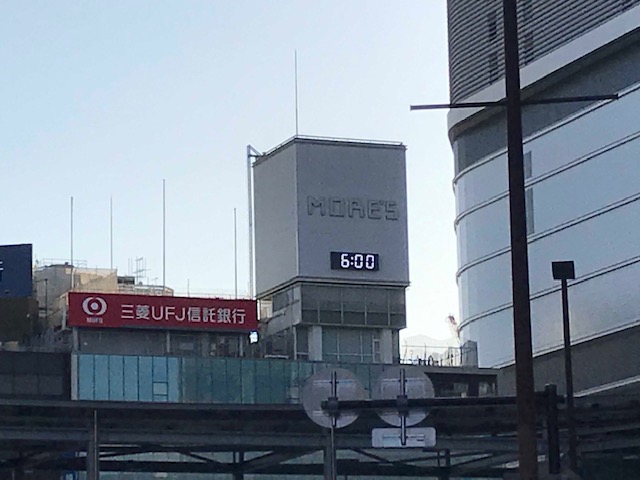
This screenshot has width=640, height=480. I want to click on glass, so click(554, 223).